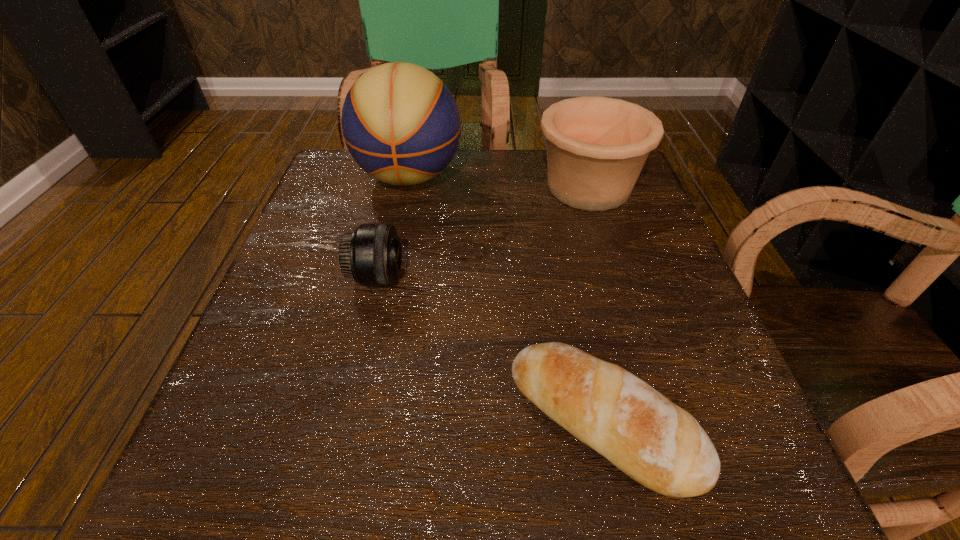
Find the location of a particular element. vacant position in the image that satisfies the following two spatial constraints: 1. on the patterned surface of the tallest object; 2. on the right side of the bread is located at coordinates (358, 420).